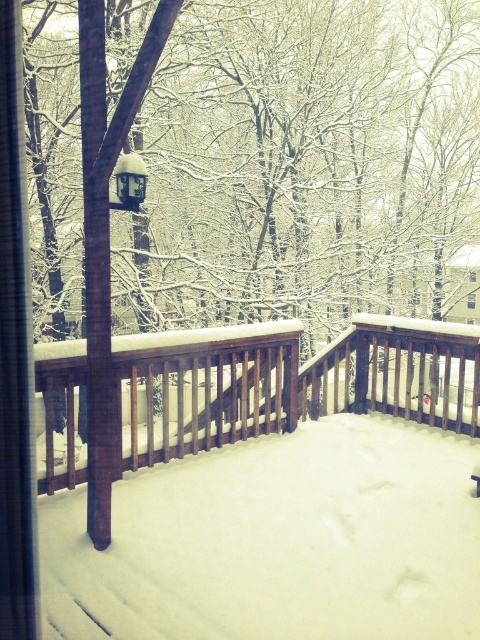
Question: Which of the following is the farthest from the observer?

Choices:
 (A) brown wooden railing at center
 (B) satin black lamp at center

Answer: (B)

Question: Considering the relative positions of brown wooden railing at center and satin black lamp at center in the image provided, where is brown wooden railing at center located with respect to satin black lamp at center?

Choices:
 (A) above
 (B) below

Answer: (B)

Question: Does brown wooden railing at center lie behind satin black lamp at center?

Choices:
 (A) yes
 (B) no

Answer: (B)

Question: Which object is closer to the camera taking this photo?

Choices:
 (A) satin black lamp at center
 (B) brown wooden railing at center

Answer: (B)

Question: In this image, where is brown wooden railing at center located relative to satin black lamp at center?

Choices:
 (A) left
 (B) right

Answer: (B)